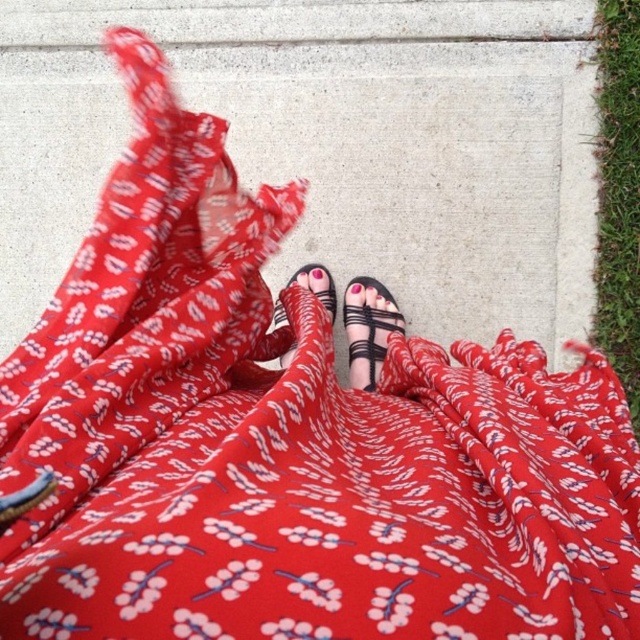
You are standing on the sidewalk and want to step onto the green grass at right. Is the matte black sandal at center blocking your path to the grass?

The matte black sandal at center is behind the green grass at right, so it is not blocking your path to the grass.

You are standing in the scene and want to step onto the green grass at right. Based on your current position, which direction should you move to reach it?

The green grass at right is located at point (x=618, y=193) in the scene, so you should move to the right and slightly forward to reach it.

You are standing on the sidewalk and see both the black leather sandal at lower center and the matte black sandal at center. Which sandal is closer to you?

The black leather sandal at lower center is closer to you because it is positioned further to the viewer than the matte black sandal at center.